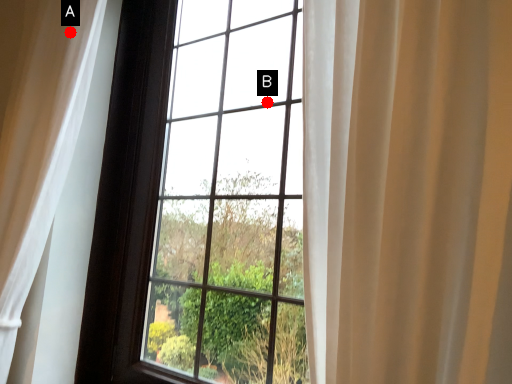
Question: Two points are circled on the image, labeled by A and B beside each circle. Which of the following is the closest to the observer?

Choices:
 (A) A is closer
 (B) B is closer

Answer: (B)